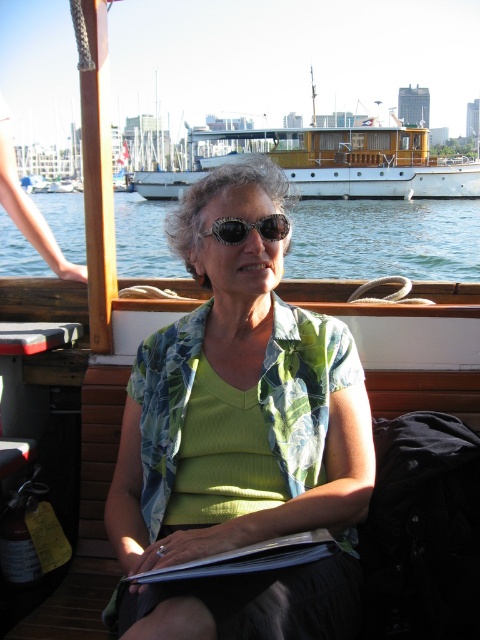
Is wooden polished boat at upper center positioned behind shiny black sunglasses at center?

Yes, it is behind shiny black sunglasses at center.

Which of these two, wooden polished boat at upper center or shiny black sunglasses at center, stands shorter?

shiny black sunglasses at center

You are a GUI agent. You are given a task and a screenshot of the screen. Output one action in this format:
    pyautogui.click(x=<x>, y=<y>)
    Task: Click on the wooden polished boat at upper center
    
    Given the screenshot: What is the action you would take?
    pyautogui.click(x=326, y=163)

Can you confirm if blue water at center is positioned to the right of white paper book at center?

In fact, blue water at center is to the left of white paper book at center.

Which of these two, blue water at center or white paper book at center, stands taller?

blue water at center is taller.

What do you see at coordinates (385, 240) in the screenshot?
I see `blue water at center` at bounding box center [385, 240].

You are a GUI agent. You are given a task and a screenshot of the screen. Output one action in this format:
    pyautogui.click(x=<x>, y=<y>)
    Task: Click on the blue water at center
    
    Given the screenshot: What is the action you would take?
    pyautogui.click(x=385, y=240)

Who is shorter, green fabric shirt at center or white paper book at center?

With less height is white paper book at center.

Which is above, green fabric shirt at center or white paper book at center?

green fabric shirt at center is higher up.

The height and width of the screenshot is (640, 480). What are the coordinates of `green fabric shirt at center` in the screenshot? It's located at (240, 438).

Find the location of `green fabric shirt at center`. green fabric shirt at center is located at coordinates (240, 438).